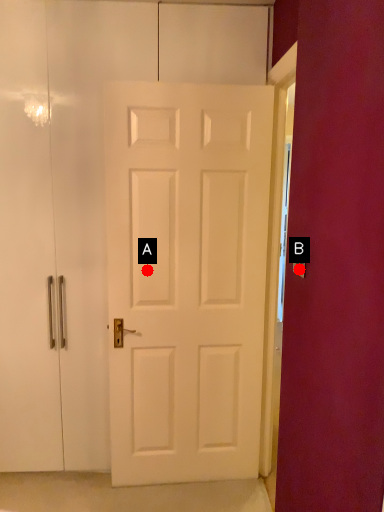
Question: Two points are circled on the image, labeled by A and B beside each circle. Which point is further to the camera?

Choices:
 (A) A is further
 (B) B is further

Answer: (A)